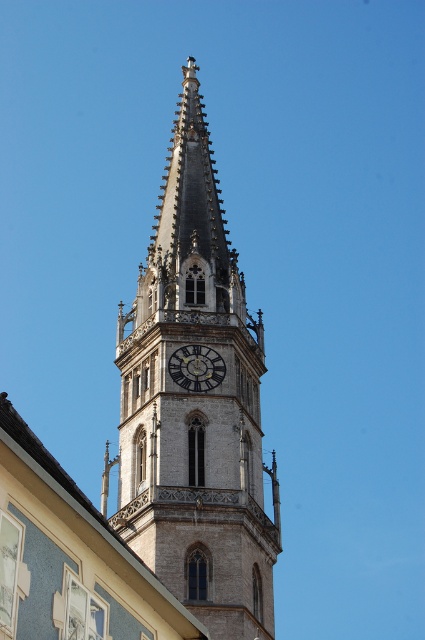
You are standing at the base of the stone clock tower at center and want to reach the top of the gold metallic clock at center. Which one is taller?

The stone clock tower at center is taller than the gold metallic clock at center, so the tower is taller.

Looking at this image, you are standing in front of the clock tower and notice two points marked on the tower. One is at coordinate point (x=218, y=310) and the other at point (x=201, y=344). From your vantage point, which point is closer to you?

Point (x=201, y=344) is closer to you because it is in front of point (x=218, y=310) according to their spatial relationship.

You are standing at the point marked as point [195,404]. What object are you standing on?

You are standing on the stone clock tower at center, as the coordinates point [195,404] correspond to its location.